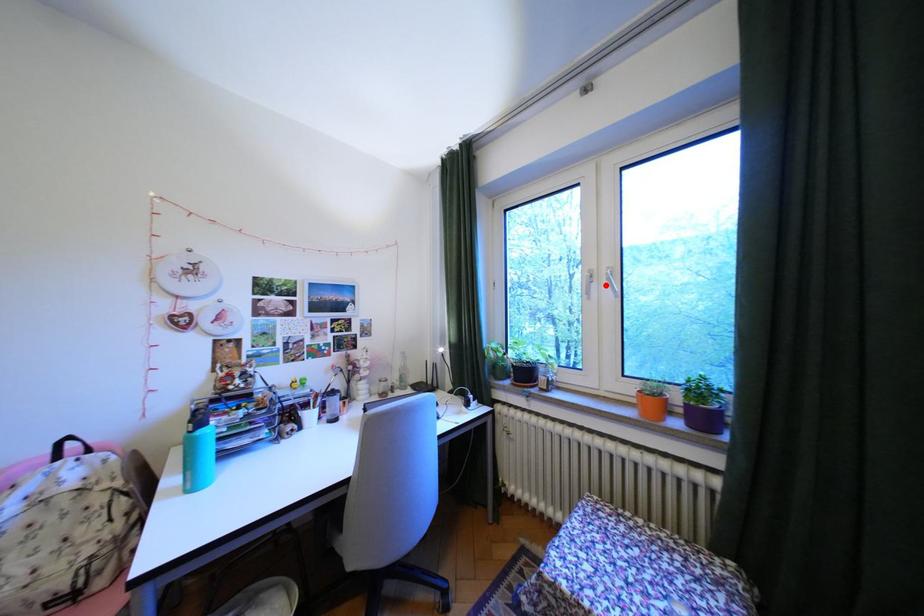
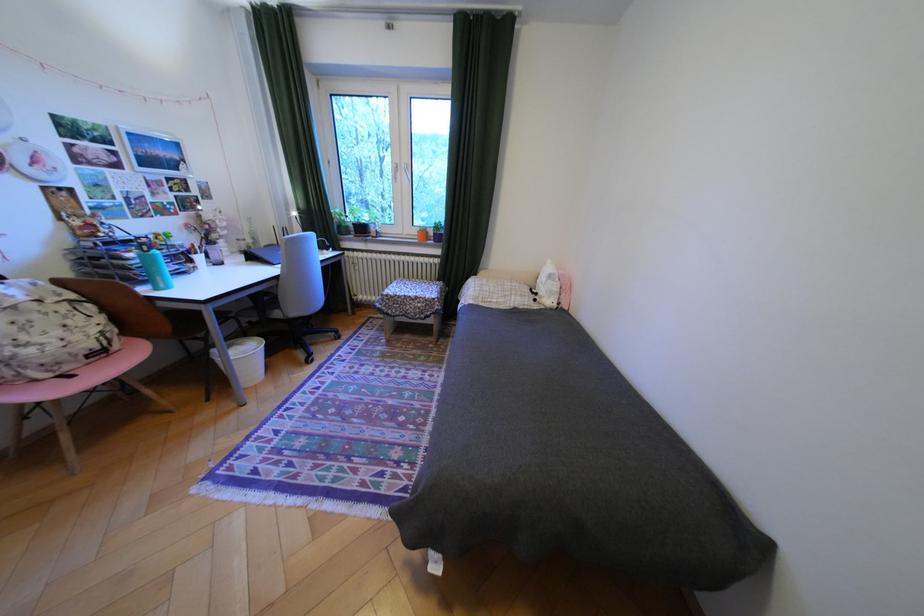
Locate, in the second image, the point that corresponds to the highlighted location in the first image.

(410, 174)